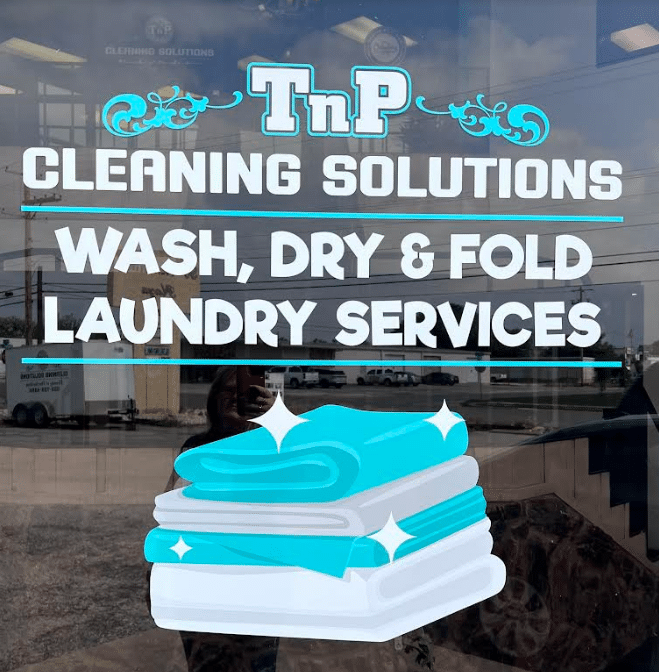
What are the coordinates of `bed sheet` in the screenshot? It's located at (355, 530), (339, 550).